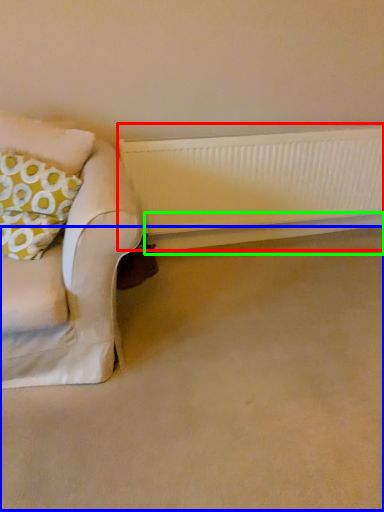
Question: Based on their relative distances, which object is nearer to radiator (highlighted by a red box)? Choose from plain (highlighted by a blue box) and window sill (highlighted by a green box).

Choices:
 (A) plain
 (B) window sill

Answer: (B)